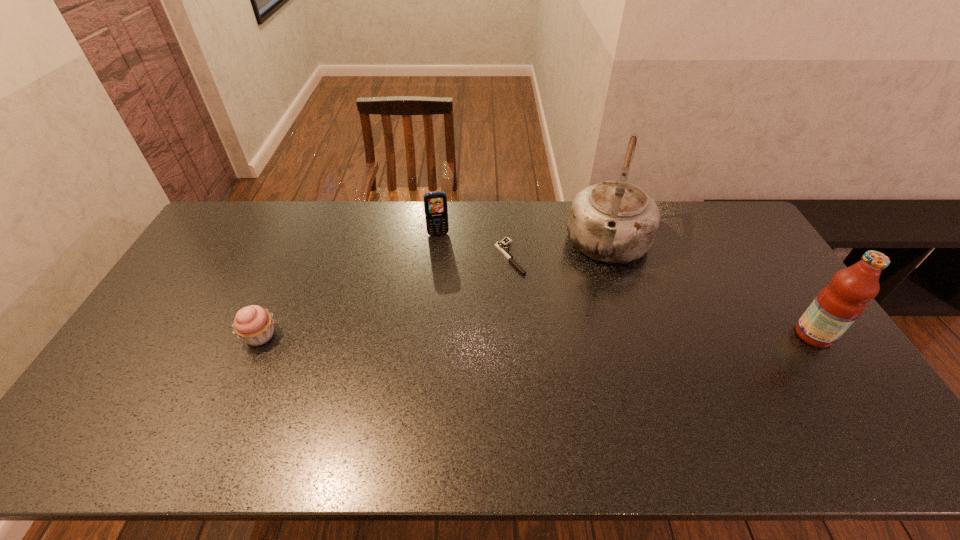
This screenshot has width=960, height=540. In order to click on free space that satisfies the following two spatial constraints: 1. on the back side of the second object from right to left; 2. on the left side of the third object from right to left in this screenshot , I will do `click(509, 246)`.

Find the location of a particular element. vacant space that satisfies the following two spatial constraints: 1. on the back side of the fourth tallest object; 2. on the left side of the second object from right to left is located at coordinates (300, 246).